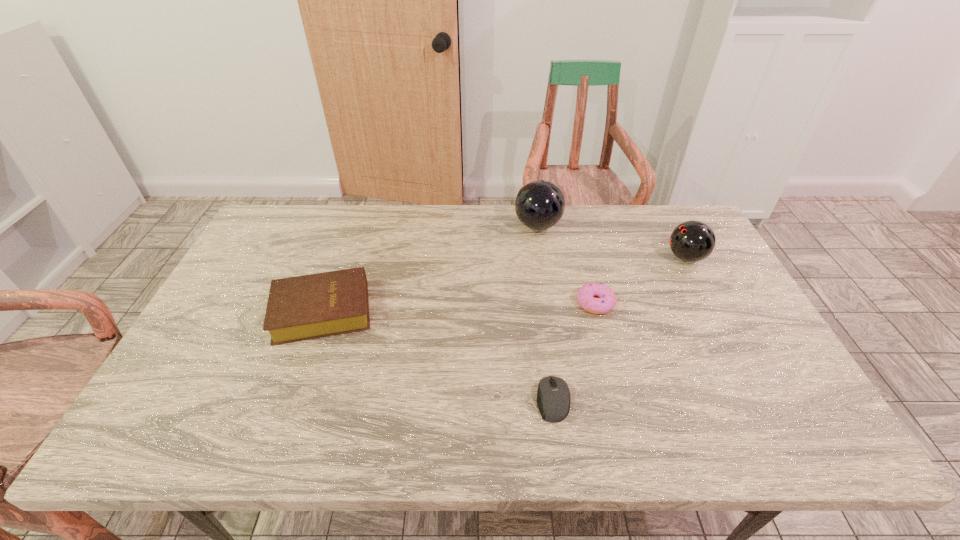
What are the coordinates of `free space located 0.210m on the side of the left bowling ball with the finger holes` in the screenshot? It's located at (453, 226).

The height and width of the screenshot is (540, 960). What are the coordinates of `vacant point located on the side of the left bowling ball with the finger holes` in the screenshot? It's located at (410, 226).

The width and height of the screenshot is (960, 540). In order to click on vacant region located on the surface of the rightmost object near the finger holes in this screenshot , I will do `click(574, 258)`.

You are a GUI agent. You are given a task and a screenshot of the screen. Output one action in this format:
    pyautogui.click(x=<x>, y=<y>)
    Task: Click on the vacant space situated on the surface of the rightmost object near the finger holes
    
    Given the screenshot: What is the action you would take?
    pyautogui.click(x=559, y=258)

Where is `vacant space located on the surface of the rightmost object near the finger holes`? The height and width of the screenshot is (540, 960). vacant space located on the surface of the rightmost object near the finger holes is located at coordinates (600, 258).

Locate an element on the screen. The width and height of the screenshot is (960, 540). free space located on the front of the third shortest object is located at coordinates (279, 433).

At what (x,y) coordinates should I click in order to perform the action: click on vacant region located 0.130m on the back of the second shortest object. Please return your answer as a coordinate pair (x, y). This screenshot has width=960, height=540. Looking at the image, I should click on (585, 261).

Where is `vacant area situated 0.280m on the right of the nearest object`? The width and height of the screenshot is (960, 540). vacant area situated 0.280m on the right of the nearest object is located at coordinates (688, 400).

Identify the location of object positioned at the near edge. (553, 396).

What are the coordinates of `object located in the right edge section of the desktop` in the screenshot? It's located at (691, 241).